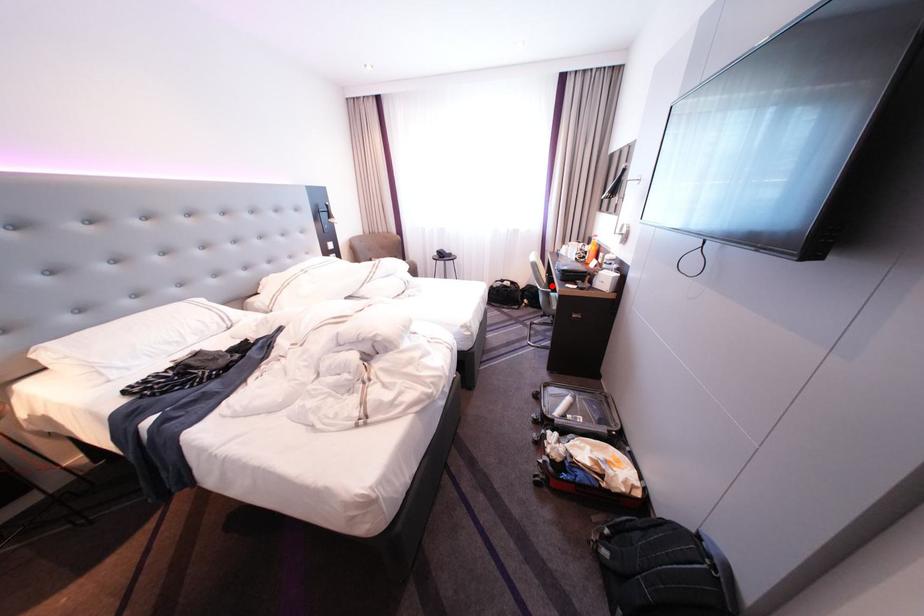
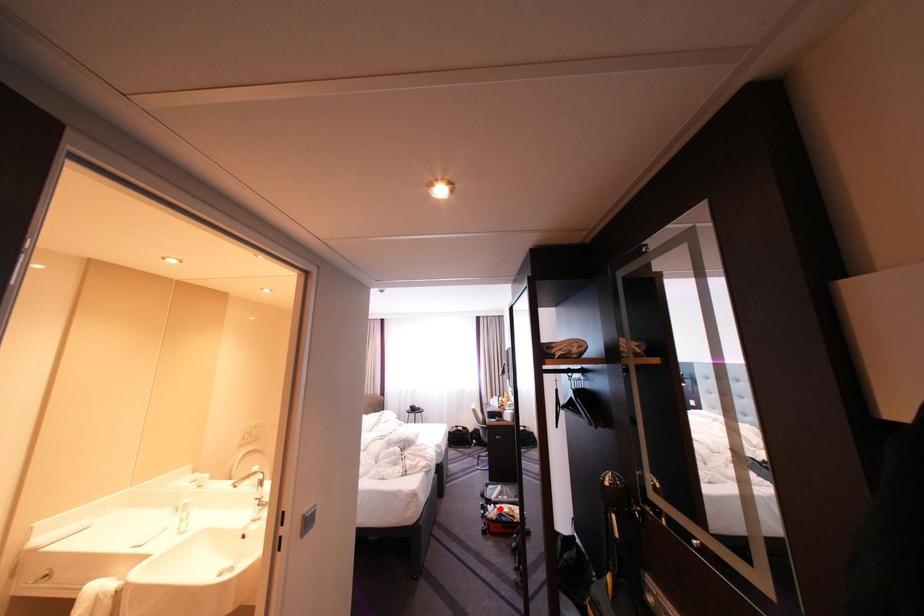
I am providing you with two images of the same scene from different viewpoints. A red point is marked on the first image and another point is marked on the second image. Are the points marked in image1 and image2 representing the same 3D position?

No